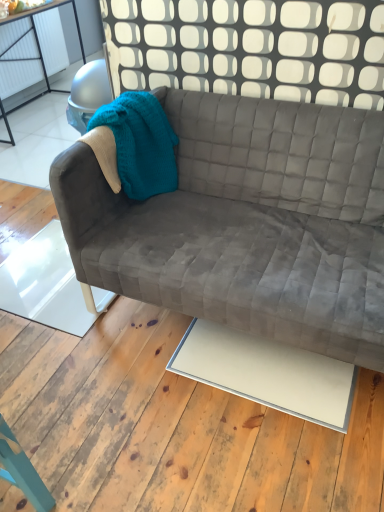
Question: Considering the positions of velvet gray couch at center and white matte plywood at center in the image, is velvet gray couch at center wider or thinner than white matte plywood at center?

Choices:
 (A) wide
 (B) thin

Answer: (B)

Question: From the image's perspective, is velvet gray couch at center located above or below white matte plywood at center?

Choices:
 (A) below
 (B) above

Answer: (B)

Question: From a real-world perspective, is velvet gray couch at center positioned above or below white matte plywood at center?

Choices:
 (A) above
 (B) below

Answer: (A)

Question: Considering the positions of white matte plywood at center and velvet gray couch at center in the image, is white matte plywood at center bigger or smaller than velvet gray couch at center?

Choices:
 (A) big
 (B) small

Answer: (B)

Question: From a real-world perspective, is white matte plywood at center positioned above or below velvet gray couch at center?

Choices:
 (A) above
 (B) below

Answer: (B)

Question: In terms of height, does white matte plywood at center look taller or shorter compared to velvet gray couch at center?

Choices:
 (A) short
 (B) tall

Answer: (A)

Question: From the image's perspective, is white matte plywood at center positioned above or below velvet gray couch at center?

Choices:
 (A) below
 (B) above

Answer: (A)